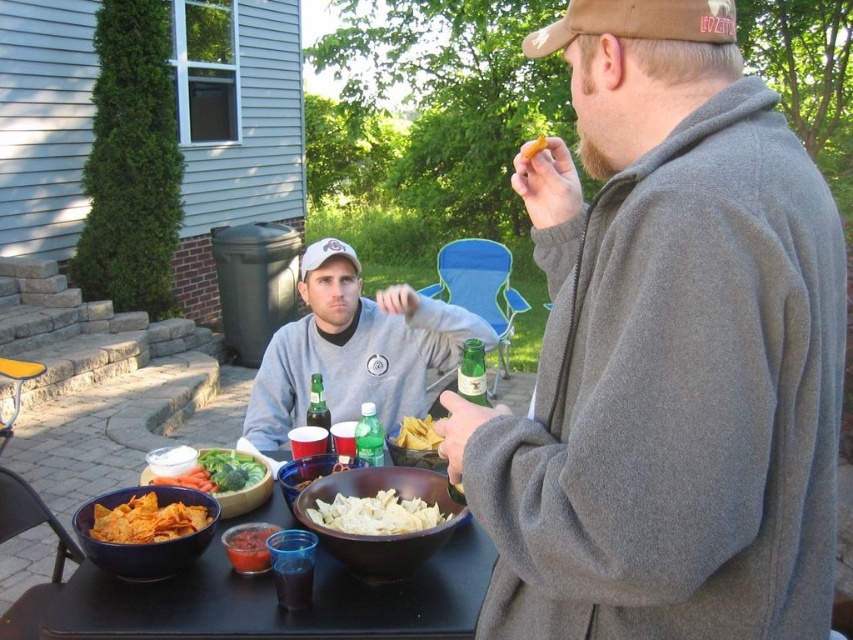
You are organizing a picnic and need to place a gray fleece sweatshirt at center and a yellow plastic picnic table at lower left. According to the scene, where should you place the gray fleece sweatshirt relative to the yellow plastic picnic table?

The gray fleece sweatshirt at center should be placed on the right side of the yellow plastic picnic table at lower left.